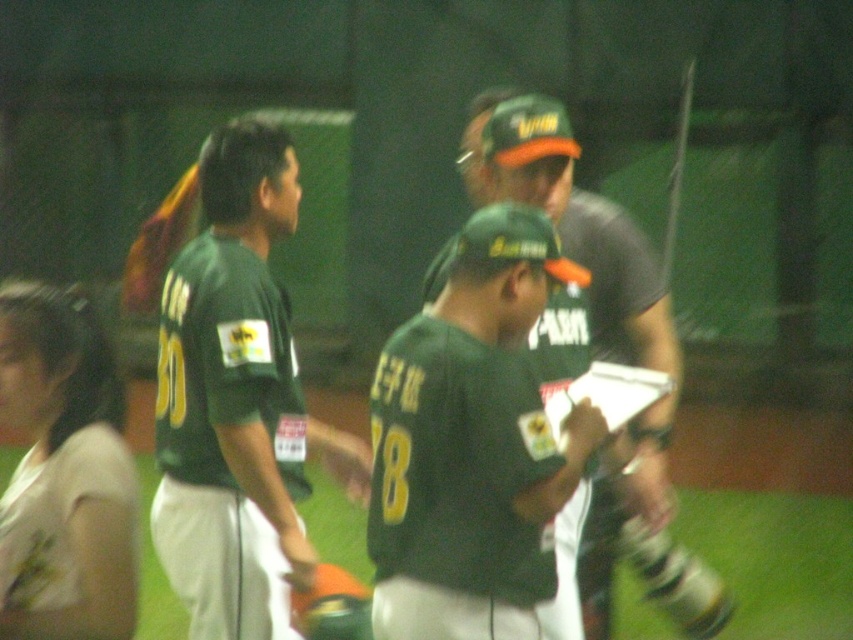
Does matte green jersey at center appear over matte green cap at center?

Incorrect, matte green jersey at center is not positioned above matte green cap at center.

Does point (393, 490) lie in front of point (474, 173)?

Yes, it is.

Where is `matte green jersey at center`? This screenshot has width=853, height=640. matte green jersey at center is located at coordinates (465, 492).

Where is `matte green jersey at center`? matte green jersey at center is located at coordinates (465, 492).

Between green matte jersey at center and matte green cap at center, which one appears on the left side from the viewer's perspective?

green matte jersey at center is more to the left.

I want to click on green matte jersey at center, so click(223, 438).

Where is `green matte jersey at center`? This screenshot has height=640, width=853. green matte jersey at center is located at coordinates (223, 438).

Who is taller, matte green jersey at center or green matte jersey at center?

green matte jersey at center

What do you see at coordinates (465, 492) in the screenshot? I see `matte green jersey at center` at bounding box center [465, 492].

Locate an element on the screen. matte green jersey at center is located at coordinates (465, 492).